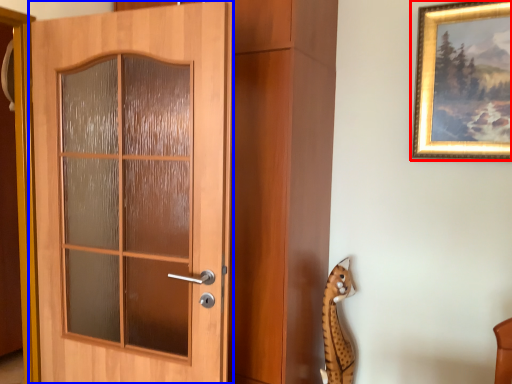
Question: Among these objects, which one is nearest to the camera, picture frame (highlighted by a red box) or door (highlighted by a blue box)?

Choices:
 (A) picture frame
 (B) door

Answer: (B)